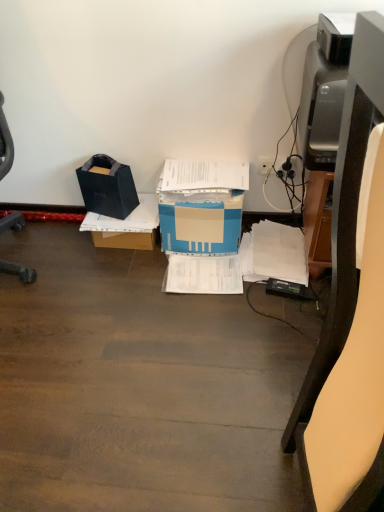
You are a GUI agent. You are given a task and a screenshot of the screen. Output one action in this format:
    pyautogui.click(x=<x>, y=<y>)
    Task: Click on the blank space situated above brown cardboard box at center (from a real-world perspective)
    The width and height of the screenshot is (384, 512).
    Given the screenshot: What is the action you would take?
    click(x=130, y=208)